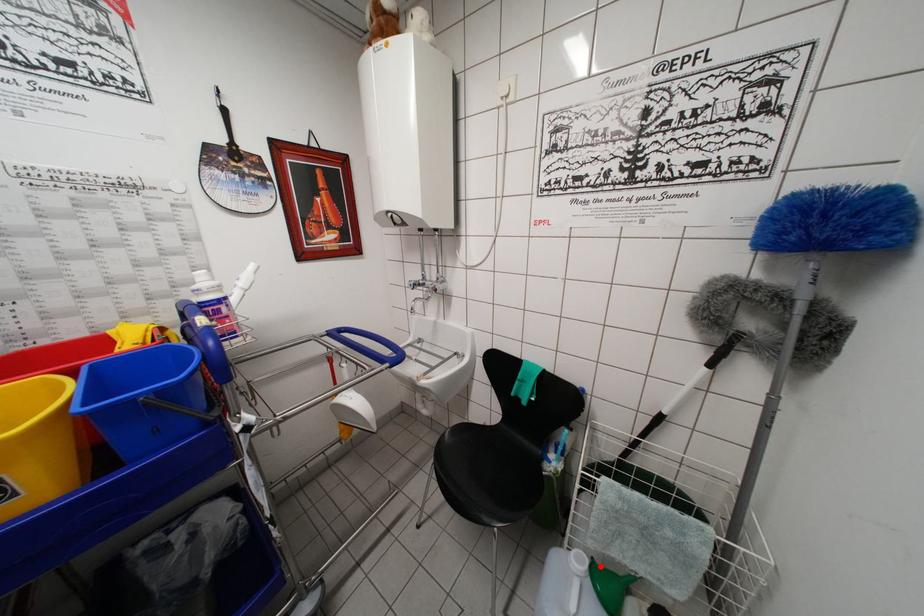
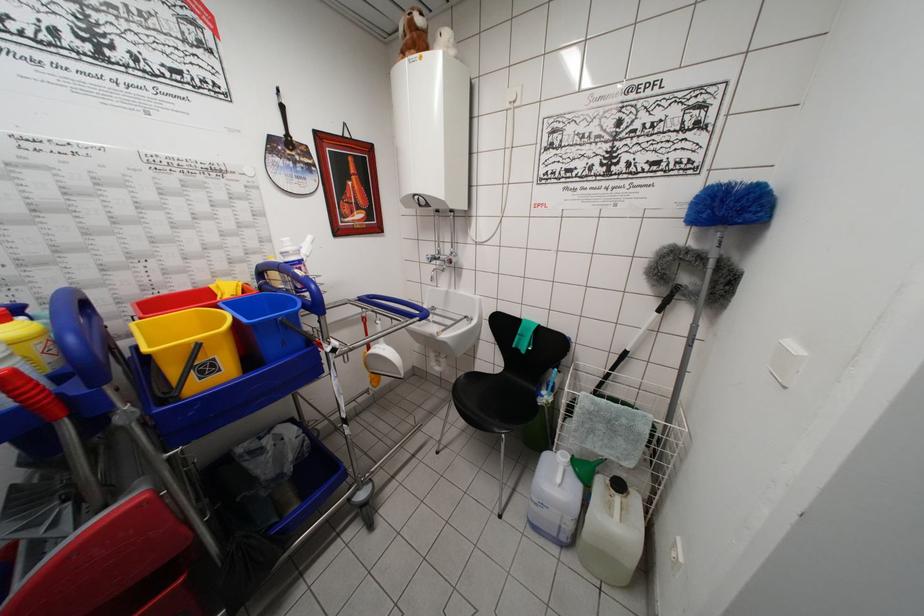
Question: I am providing you with two images of the same scene from different viewpoints. In image1, a red point is highlighted. Considering the same 3D point in image2, which of the following is correct?

Choices:
 (A) It is closer
 (B) It is farther

Answer: (B)